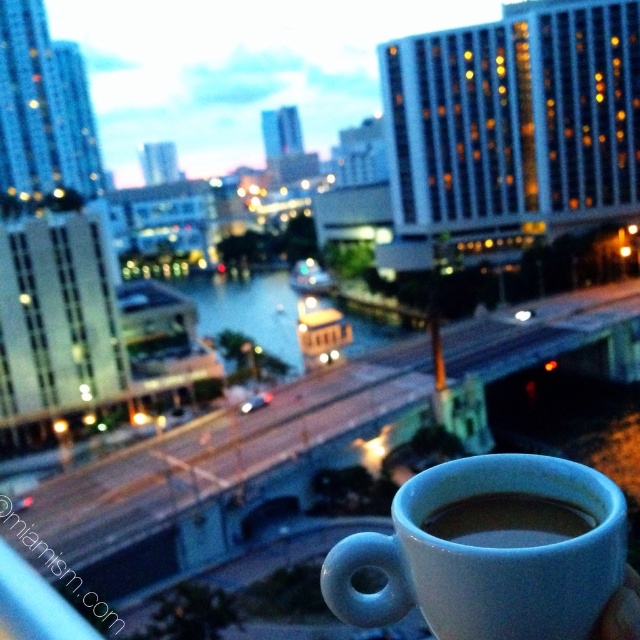
Question: Which point is closer to the camera?

Choices:
 (A) white matte cup at lower right
 (B) matte ceramic mug at lower right

Answer: (B)

Question: Is matte ceramic mug at lower right above white matte cup at lower right?

Choices:
 (A) yes
 (B) no

Answer: (B)

Question: Does matte ceramic mug at lower right appear over white matte cup at lower right?

Choices:
 (A) yes
 (B) no

Answer: (B)

Question: Is the position of matte ceramic mug at lower right more distant than that of white matte cup at lower right?

Choices:
 (A) yes
 (B) no

Answer: (B)